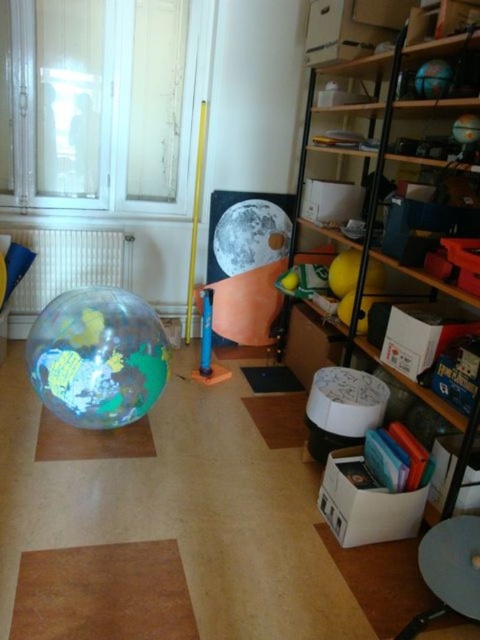
Question: Can you confirm if transparent plastic globe at center is positioned to the right of shiny metallic moon at center?

Choices:
 (A) no
 (B) yes

Answer: (A)

Question: Estimate the real-world distances between objects in this image. Which object is farther from the transparent plastic globe at center?

Choices:
 (A) wooden shelves at right
 (B) shiny metallic moon at center

Answer: (B)

Question: Does wooden shelves at right have a lesser width compared to transparent plastic globe at center?

Choices:
 (A) no
 (B) yes

Answer: (A)

Question: Among these points, which one is nearest to the camera?

Choices:
 (A) (371, 189)
 (B) (252, 234)

Answer: (A)

Question: Is transparent plastic globe at center wider than shiny metallic moon at center?

Choices:
 (A) no
 (B) yes

Answer: (B)

Question: Which object is farther from the camera taking this photo?

Choices:
 (A) wooden shelves at right
 (B) transparent plastic globe at center
 (C) shiny metallic moon at center

Answer: (C)